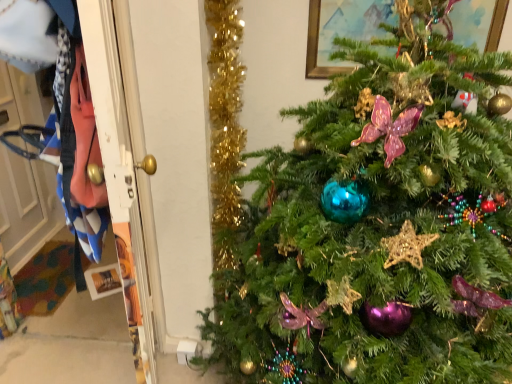
In order to face shiny green christmas tree at right, should I rotate leftwards or rightwards?

Turn right by 19.166 degrees to look at shiny green christmas tree at right.

In order to click on shiny green christmas tree at right in this screenshot , I will do `click(379, 224)`.

The width and height of the screenshot is (512, 384). What do you see at coordinates (379, 224) in the screenshot?
I see `shiny green christmas tree at right` at bounding box center [379, 224].

The width and height of the screenshot is (512, 384). In order to click on shiny green christmas tree at right in this screenshot , I will do `click(379, 224)`.